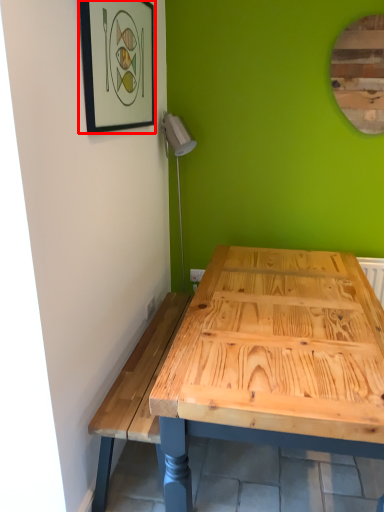
Question: Where is picture frame (annotated by the red box) located in relation to mirror in the image?

Choices:
 (A) left
 (B) right

Answer: (A)